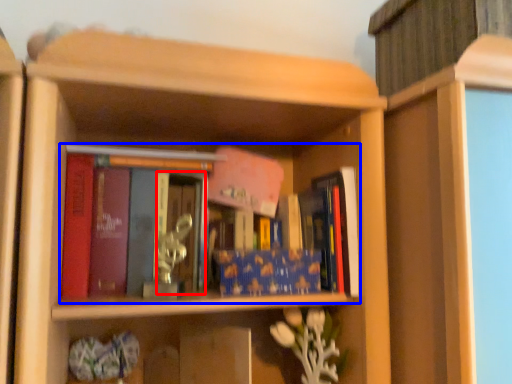
Question: Which object appears farthest to the camera in this image, glass door (highlighted by a red box) or book (highlighted by a blue box)?

Choices:
 (A) glass door
 (B) book

Answer: (B)